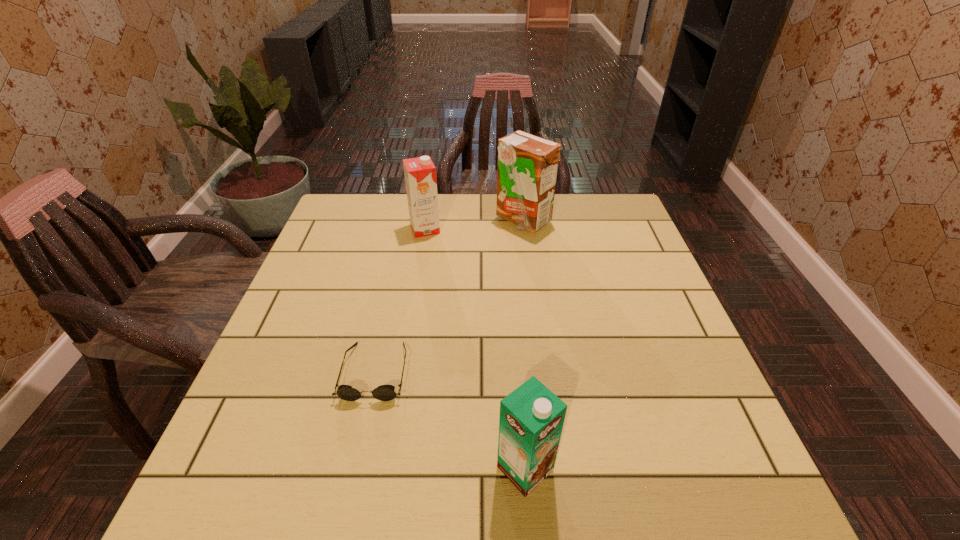
Find the location of a particular element. The image size is (960, 540). carton that is the second closest to the sunglasses is located at coordinates (420, 173).

Where is `the second closest carton to the leftmost carton`? This screenshot has height=540, width=960. the second closest carton to the leftmost carton is located at coordinates (531, 420).

Locate an element on the screen. vacant space that satisfies the following two spatial constraints: 1. on the front-facing side of the nearest object; 2. on the right side of the sunglasses is located at coordinates (353, 469).

Find the location of a particular element. vacant area in the image that satisfies the following two spatial constraints: 1. on the front-facing side of the nearest carton; 2. on the right side of the second nearest object is located at coordinates (353, 469).